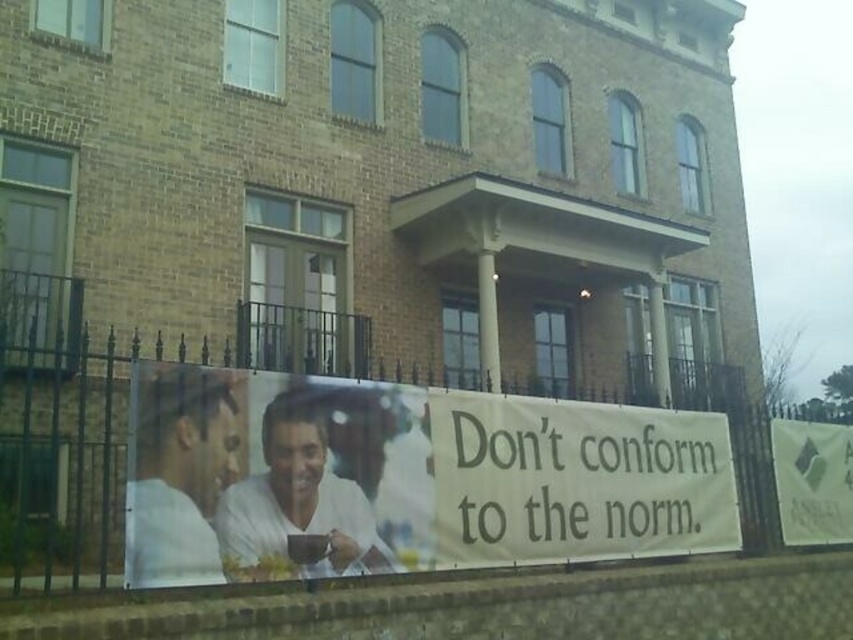
Is point (717, 483) farther from viewer compared to point (834, 488)?

No, (717, 483) is in front of (834, 488).

Is white paper banner at center shorter than green fabric sign at lower right?

In fact, white paper banner at center may be taller than green fabric sign at lower right.

Which is behind, point (633, 540) or point (840, 493)?

Point (840, 493)

Locate an element on the screen. white paper banner at center is located at coordinates (575, 481).